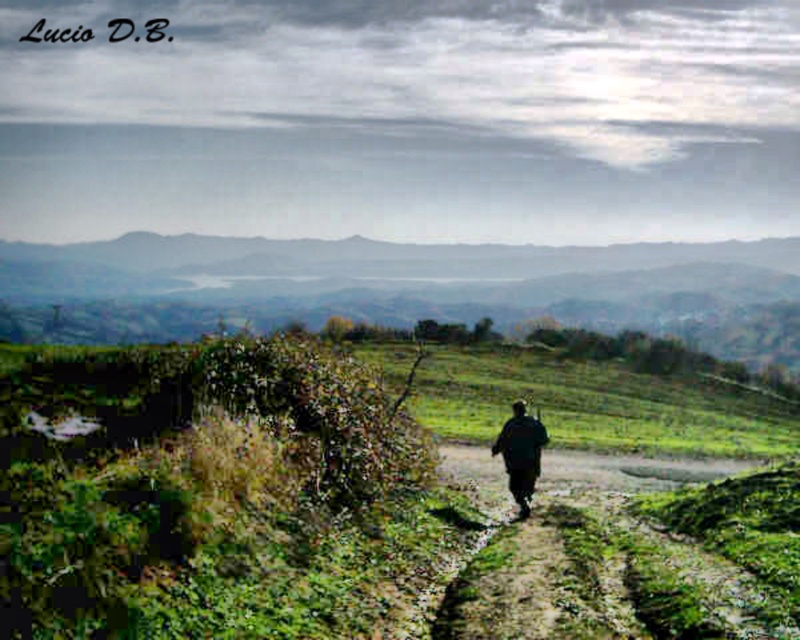
You are a hiker who wants to set up a tent on the green grassy hill at center and the dark green fabric at center. Which location has a wider area for setting up the tent?

The green grassy hill at center has a wider area for setting up the tent because its width surpasses that of the dark green fabric at center.